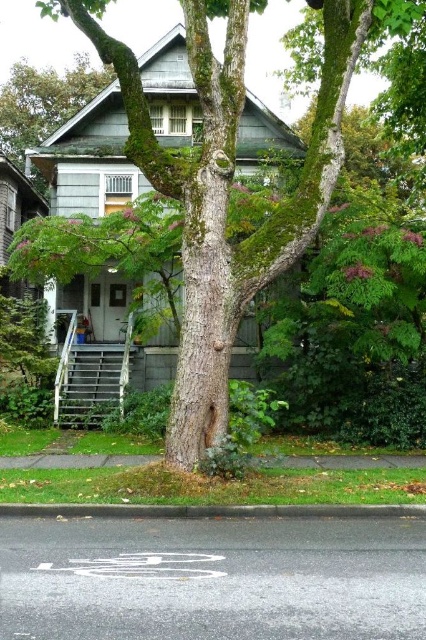
You are standing at the base of the green mossy tree at center and want to look up at the green mossy tree at upper left. Which direction should you turn your head to see it?

You should look upwards to see the green mossy tree at upper left since it is above the green mossy tree at center.

You are standing in front of the house and notice a point marked at coordinates (230,182). Based on the scene description, what object does this point correspond to?

The point at coordinates (230,182) corresponds to the green mossy tree at center.